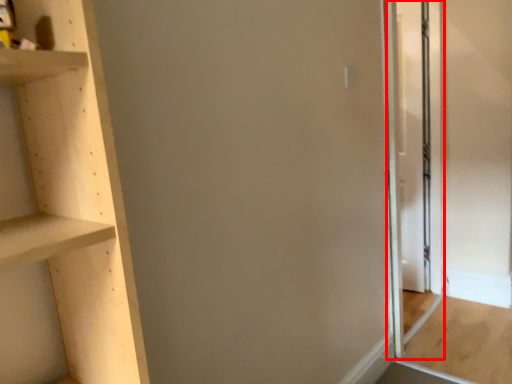
Question: From the image's perspective, what is the correct spatial relationship of screen door (annotated by the red box) in relation to plywood?

Choices:
 (A) below
 (B) above

Answer: (B)